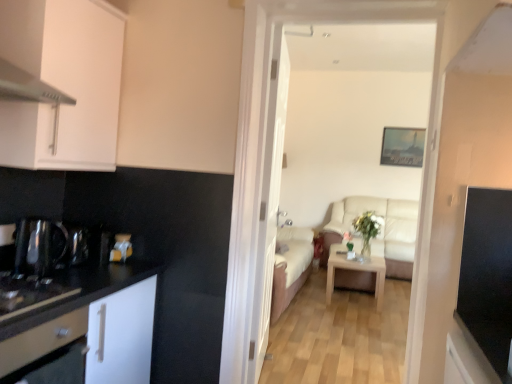
Question: From a real-world perspective, is light wood/texture coffee table at center on top of white glossy drawer at left?

Choices:
 (A) yes
 (B) no

Answer: (B)

Question: Could you tell me if light wood/texture coffee table at center is turned towards white glossy drawer at left?

Choices:
 (A) yes
 (B) no

Answer: (A)

Question: Is light wood/texture coffee table at center not within white glossy drawer at left?

Choices:
 (A) no
 (B) yes

Answer: (B)

Question: Is light wood/texture coffee table at center thinner than white glossy drawer at left?

Choices:
 (A) no
 (B) yes

Answer: (A)

Question: Is light wood/texture coffee table at center at the left side of white glossy drawer at left?

Choices:
 (A) yes
 (B) no

Answer: (B)

Question: In terms of height, does light wood/texture coffee table at center look taller or shorter compared to black matte dishwasher at lower left?

Choices:
 (A) short
 (B) tall

Answer: (B)

Question: Visually, is light wood/texture coffee table at center positioned to the left or to the right of black matte dishwasher at lower left?

Choices:
 (A) right
 (B) left

Answer: (A)

Question: Considering their positions, is light wood/texture coffee table at center located in front of or behind black matte dishwasher at lower left?

Choices:
 (A) front
 (B) behind

Answer: (B)

Question: From the image's perspective, is light wood/texture coffee table at center located above or below black matte dishwasher at lower left?

Choices:
 (A) above
 (B) below

Answer: (B)

Question: Does point (339, 259) appear closer or farther from the camera than point (17, 246)?

Choices:
 (A) farther
 (B) closer

Answer: (A)

Question: From the image's perspective, is light wood/texture coffee table at center positioned above or below shiny metallic kettle at left, the 1th appliance when ordered from left to right?

Choices:
 (A) above
 (B) below

Answer: (B)

Question: Considering their positions, is light wood/texture coffee table at center located in front of or behind shiny metallic kettle at left, the 1th appliance when ordered from left to right?

Choices:
 (A) behind
 (B) front

Answer: (A)

Question: In terms of size, does light wood/texture coffee table at center appear bigger or smaller than shiny metallic kettle at left, which appears as the second appliance when viewed from the right?

Choices:
 (A) big
 (B) small

Answer: (A)

Question: From the image's perspective, relative to white wooden door at center, is black matte dishwasher at lower left above or below?

Choices:
 (A) below
 (B) above

Answer: (A)

Question: Considering the relative positions of black matte dishwasher at lower left and white wooden door at center in the image provided, is black matte dishwasher at lower left to the left or to the right of white wooden door at center?

Choices:
 (A) left
 (B) right

Answer: (A)